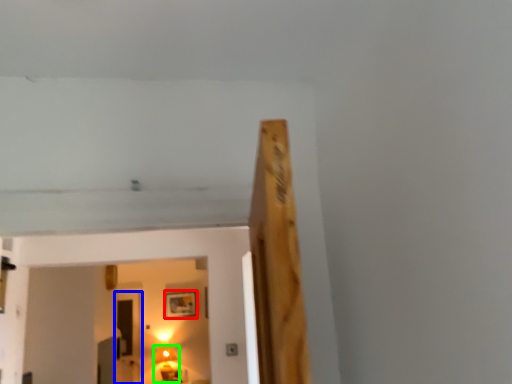
Question: Which object is positioned closest to picture frame (highlighted by a red box)? Select from glass door (highlighted by a blue box) and lamp (highlighted by a green box).

Choices:
 (A) glass door
 (B) lamp

Answer: (B)